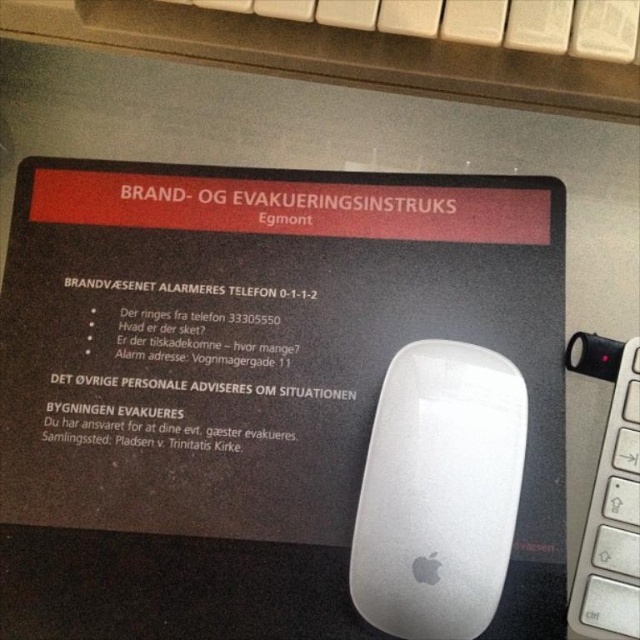
Does white matte mouse at center have a greater width compared to white plastic keyboard at right?

Correct, the width of white matte mouse at center exceeds that of white plastic keyboard at right.

Is white matte mouse at center thinner than white plastic keyboard at right?

In fact, white matte mouse at center might be wider than white plastic keyboard at right.

Where is `white matte mouse at center`? Image resolution: width=640 pixels, height=640 pixels. white matte mouse at center is located at coordinates pyautogui.click(x=440, y=492).